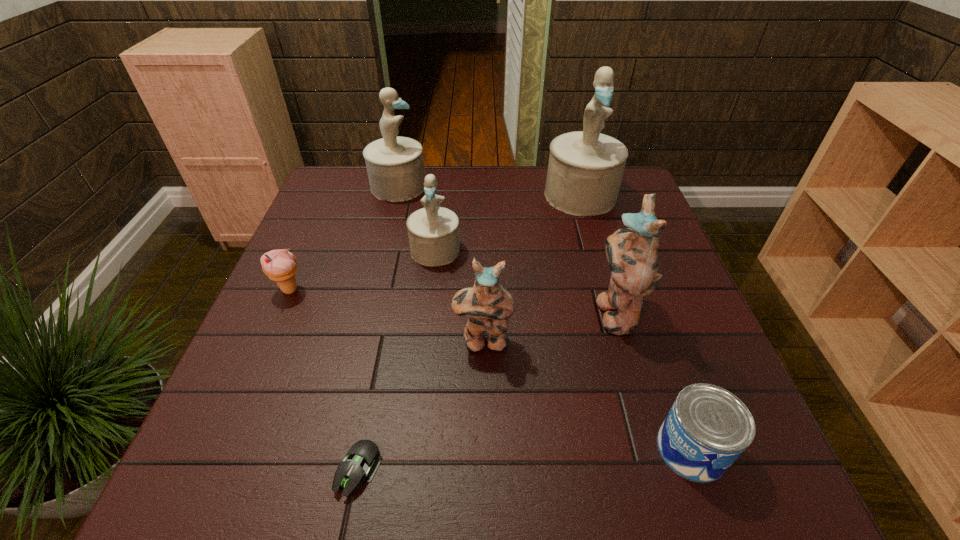
This screenshot has width=960, height=540. I want to click on free space located on the front of the icecream, so click(x=221, y=449).

Locate an element on the screen. The image size is (960, 540). free location located on the front label of the second shortest object is located at coordinates (600, 449).

You are a GUI agent. You are given a task and a screenshot of the screen. Output one action in this format:
    pyautogui.click(x=<x>, y=<y>)
    Task: Click on the vacant position located on the front label of the second shortest object
    
    Given the screenshot: What is the action you would take?
    pyautogui.click(x=519, y=449)

Locate an element on the screen. The image size is (960, 540). free location located on the front label of the second shortest object is located at coordinates (531, 449).

This screenshot has height=540, width=960. I want to click on vacant region located 0.190m on the back of the computer mouse, so click(x=382, y=354).

Identify the location of can present at the near edge. click(707, 428).

Locate an element on the screen. The height and width of the screenshot is (540, 960). computer mouse at the near edge is located at coordinates (363, 459).

Image resolution: width=960 pixels, height=540 pixels. What are the coordinates of `figurine that is at the left edge` in the screenshot? It's located at (395, 167).

Where is `icecream that is at the left edge`? Image resolution: width=960 pixels, height=540 pixels. icecream that is at the left edge is located at coordinates (280, 265).

I want to click on can present at the right edge, so click(x=707, y=428).